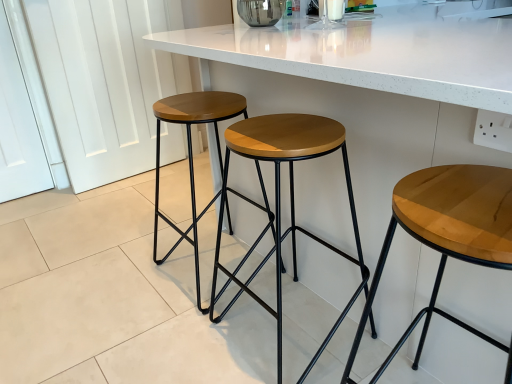
Image resolution: width=512 pixels, height=384 pixels. What are the coordinates of `vacant space that is in between wooden/matte stool at center, the first stool when ordered from left to right, and woodenmaterial/texturestool at center, the 2th stool when ordered from left to right` in the screenshot? It's located at (236, 307).